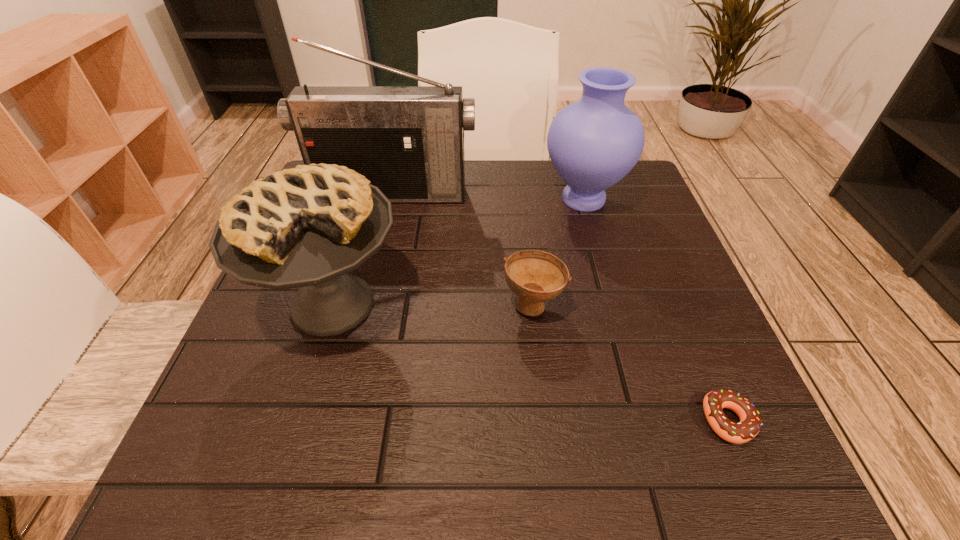
In order to click on unoccupied area between the shortest object and the soup bowl in this screenshot , I will do pos(631,362).

The image size is (960, 540). Identify the location of free space that is in between the soup bowl and the pie. (433, 304).

Locate an element on the screen. vacant point located between the third shortest object and the vase is located at coordinates (458, 252).

This screenshot has height=540, width=960. I want to click on free space between the pie and the fourth tallest object, so click(x=433, y=304).

Find the location of a particular element. object that is the second closest to the vase is located at coordinates (535, 276).

Select which object appears as the closest to the radio receiver. Please provide its 2D coordinates. Your answer should be formatted as a tuple, i.e. [(x, y)], where the tuple contains the x and y coordinates of a point satisfying the conditions above.

[(593, 143)]

This screenshot has width=960, height=540. I want to click on vacant region that satisfies the following two spatial constraints: 1. on the cut side of the third shortest object; 2. on the left side of the shortest object, so click(x=297, y=420).

What are the coordinates of `vacant point that satisfies the following two spatial constraints: 1. on the cut side of the shortest object; 2. on the left side of the third tallest object` in the screenshot? It's located at (297, 420).

This screenshot has height=540, width=960. I want to click on vacant area that satisfies the following two spatial constraints: 1. on the front-facing side of the doughnut; 2. on the right side of the tallest object, so click(x=338, y=420).

Locate an element on the screen. free space that satisfies the following two spatial constraints: 1. on the back side of the soup bowl; 2. on the right side of the vase is located at coordinates (520, 199).